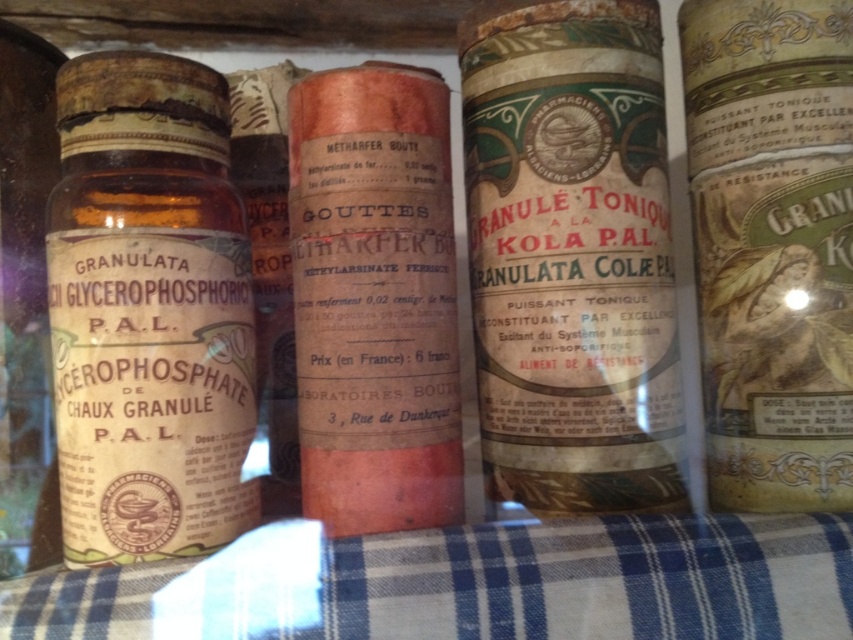
Question: Which point appears closest to the camera in this image?

Choices:
 (A) (824, 182)
 (B) (543, 396)

Answer: (B)

Question: Which object is positioned farthest from the amber glass bottle at left?

Choices:
 (A) orange paper bottle at center
 (B) vintage paper-toned tonique at center

Answer: (B)

Question: Does green paper label at center have a lesser width compared to orange paper bottle at center?

Choices:
 (A) yes
 (B) no

Answer: (B)

Question: Does green paper label at center appear on the right side of amber glass bottle at left?

Choices:
 (A) no
 (B) yes

Answer: (B)

Question: Is vintage paper-toned tonique at center thinner than orange paper bottle at center?

Choices:
 (A) yes
 (B) no

Answer: (A)

Question: Which of the following is the closest to the observer?

Choices:
 (A) amber glass bottle at left
 (B) vintage paper-toned tonique at center
 (C) green paper label at center

Answer: (A)